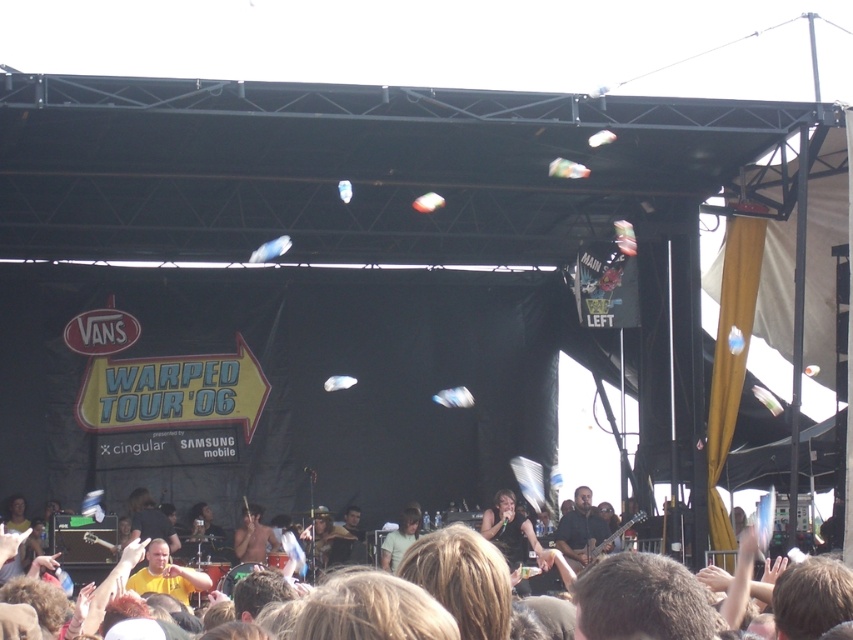
Based on the photo, can you confirm if dark brown leather guitar at center is smaller than shiny metallic guitar at center?

Incorrect, dark brown leather guitar at center is not smaller in size than shiny metallic guitar at center.

Is dark brown leather guitar at center to the left of shiny metallic guitar at center from the viewer's perspective?

Incorrect, dark brown leather guitar at center is not on the left side of shiny metallic guitar at center.

Which is in front, point (582, 532) or point (259, 508)?

Point (582, 532) is in front.

The image size is (853, 640). I want to click on dark brown leather guitar at center, so click(579, 529).

Is dark brown leather guitar at center bigger than light green t-shirt at center?

Yes.

The height and width of the screenshot is (640, 853). What do you see at coordinates (579, 529) in the screenshot? I see `dark brown leather guitar at center` at bounding box center [579, 529].

Which is behind, point (566, 529) or point (408, 513)?

Point (408, 513)

The image size is (853, 640). Identify the location of dark brown leather guitar at center. (579, 529).

Does shiny metallic guitar at center have a greater height compared to light green t-shirt at center?

In fact, shiny metallic guitar at center may be shorter than light green t-shirt at center.

Who is positioned more to the right, shiny metallic guitar at center or light green t-shirt at center?

From the viewer's perspective, light green t-shirt at center appears more on the right side.

Does point (257, 548) come farther from viewer compared to point (401, 516)?

No, it is in front of (401, 516).

Identify the location of shiny metallic guitar at center. (252, 536).